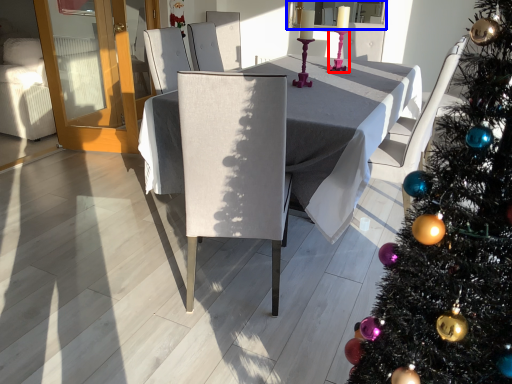
Question: Among these objects, which one is farthest to the camera, candle holder (highlighted by a red box) or window screen (highlighted by a blue box)?

Choices:
 (A) candle holder
 (B) window screen

Answer: (B)